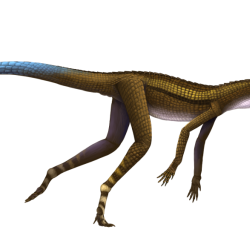
This screenshot has width=250, height=250. In order to click on scales in this screenshot , I will do (142, 98), (143, 123), (183, 134), (142, 156), (78, 83), (182, 114), (228, 89).